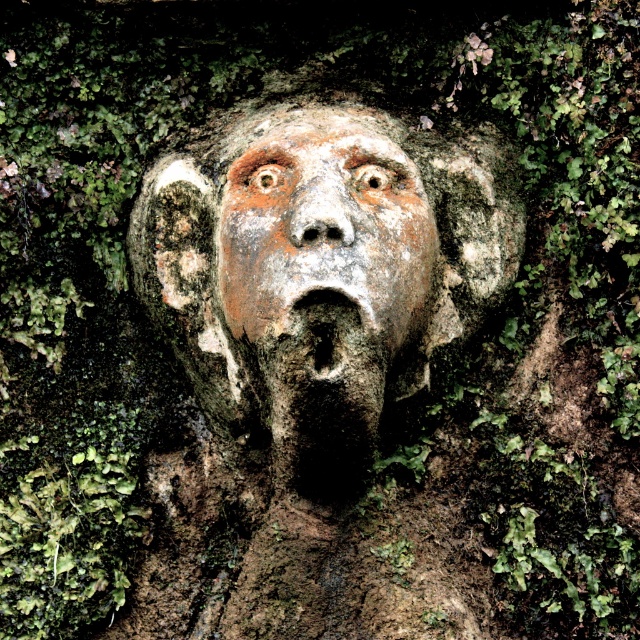
Question: Does weathered stone face at center have a greater width compared to rusty stone face at center?

Choices:
 (A) yes
 (B) no

Answer: (A)

Question: Is weathered stone face at center to the left of rusty stone face at center from the viewer's perspective?

Choices:
 (A) no
 (B) yes

Answer: (B)

Question: Among these points, which one is nearest to the camera?

Choices:
 (A) (360, 257)
 (B) (250, 154)

Answer: (A)

Question: Which object appears closest to the camera in this image?

Choices:
 (A) rusty stone face at center
 (B) weathered stone face at center

Answer: (B)

Question: Can you confirm if weathered stone face at center is positioned above rusty stone face at center?

Choices:
 (A) no
 (B) yes

Answer: (A)

Question: Which of the following is the closest to the observer?

Choices:
 (A) (240, 196)
 (B) (472, 202)

Answer: (A)